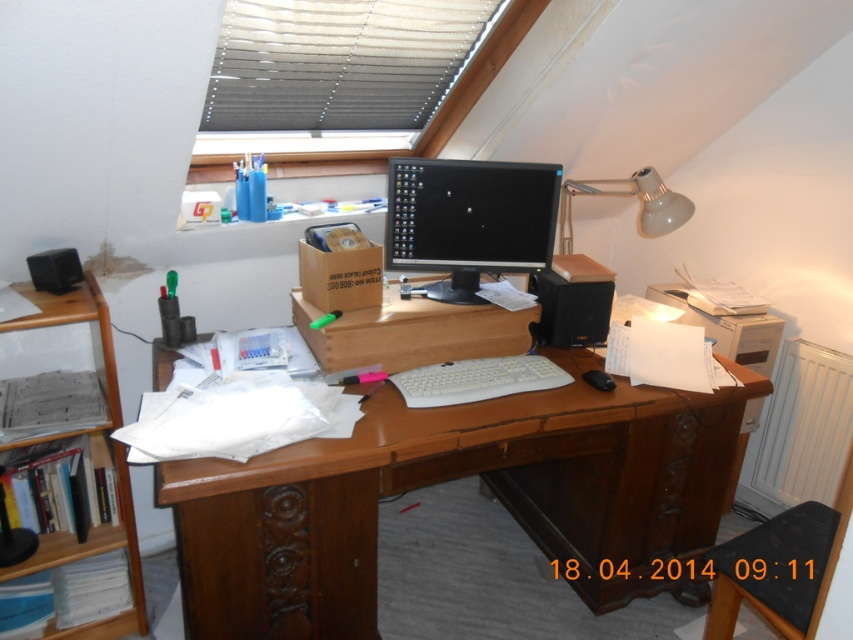
You are organizing your desk and want to place a new monitor that requires 20 cm of clearance above it. The brown wooden desk at center has the white plastic keyboard at center on it. Can you safely place the monitor on the desk without blocking the window above?

The brown wooden desk at center is taller than the white plastic keyboard at center, but the description does not provide specific height measurements. Therefore, it is unclear if there is sufficient clearance for the monitor. Check the actual dimensions before placing it.

You are standing at the entrance of the room and want to check if you can reach the black glossy monitor at center from your current position without moving closer. Your arm can extend up to 2.5 meters. Can you reach it?

The black glossy monitor at center is 5.90 feet away from camera. Since 5.90 feet is approximately 1.8 meters, which is within your arm reach of 2.5 meters, you can reach the black glossy monitor at center.